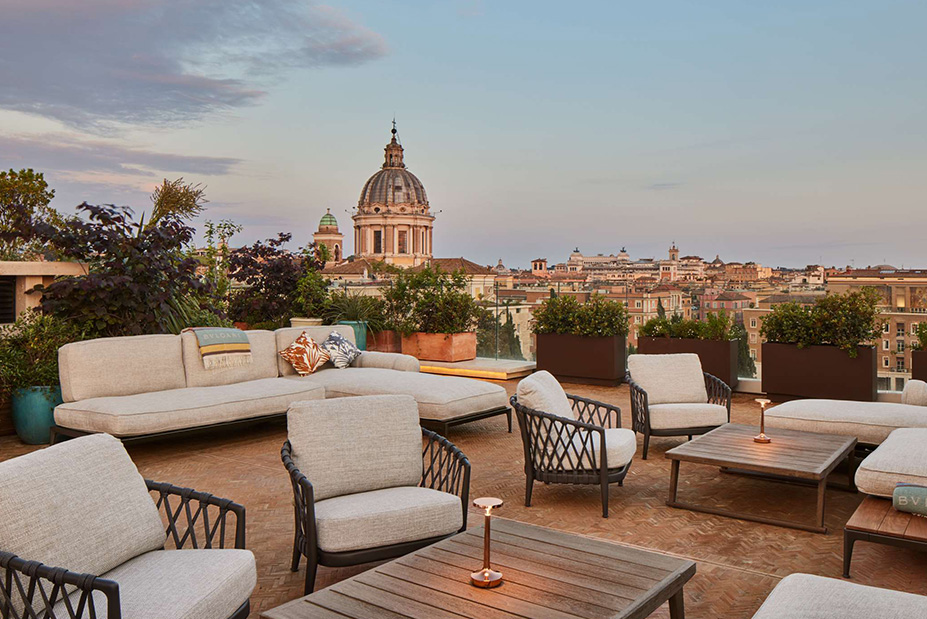
Locate an element on the screen. The image size is (927, 619). table is located at coordinates (806, 462), (578, 574).